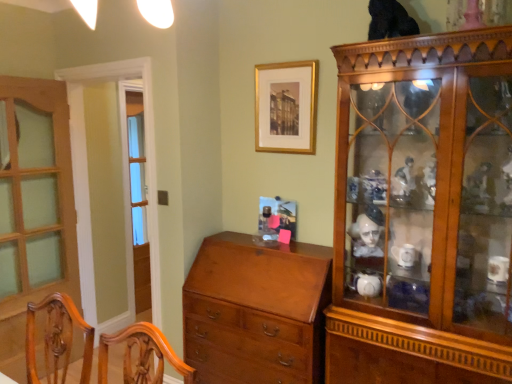
Question: Does clear glass screen door at left have a larger size compared to shiny brown chest of drawers at center?

Choices:
 (A) no
 (B) yes

Answer: (A)

Question: Is clear glass screen door at left facing towards shiny brown chest of drawers at center?

Choices:
 (A) yes
 (B) no

Answer: (B)

Question: Is clear glass screen door at left not within shiny brown chest of drawers at center?

Choices:
 (A) no
 (B) yes

Answer: (B)

Question: Does clear glass screen door at left have a smaller size compared to shiny brown chest of drawers at center?

Choices:
 (A) no
 (B) yes

Answer: (B)

Question: Are clear glass screen door at left and shiny brown chest of drawers at center beside each other?

Choices:
 (A) no
 (B) yes

Answer: (A)

Question: Does clear glass screen door at left have a greater height compared to shiny brown chest of drawers at center?

Choices:
 (A) no
 (B) yes

Answer: (B)

Question: Considering the relative sizes of black fur cat at upper center and wooden door at left in the image provided, is black fur cat at upper center taller than wooden door at left?

Choices:
 (A) yes
 (B) no

Answer: (B)

Question: Can you confirm if black fur cat at upper center is wider than wooden door at left?

Choices:
 (A) no
 (B) yes

Answer: (B)

Question: Does black fur cat at upper center come in front of wooden door at left?

Choices:
 (A) no
 (B) yes

Answer: (B)

Question: From the image's perspective, does black fur cat at upper center appear higher than wooden door at left?

Choices:
 (A) no
 (B) yes

Answer: (B)

Question: Does black fur cat at upper center have a lesser width compared to wooden door at left?

Choices:
 (A) yes
 (B) no

Answer: (B)

Question: Is black fur cat at upper center placed right next to wooden door at left?

Choices:
 (A) no
 (B) yes

Answer: (A)

Question: Considering the relative positions of gold framed picture at upper center and black fur cat at upper center in the image provided, is gold framed picture at upper center to the right of black fur cat at upper center from the viewer's perspective?

Choices:
 (A) yes
 (B) no

Answer: (B)